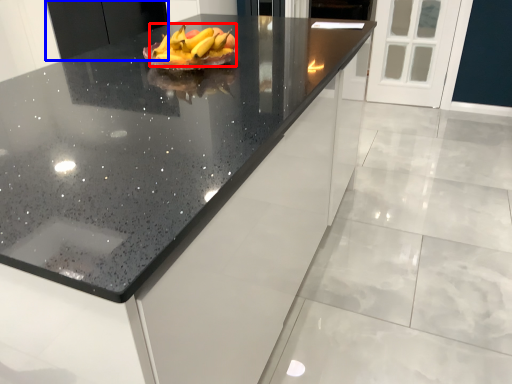
Question: Which of the following is the farthest to the observer, grapefruit (highlighted by a red box) or cabinetry (highlighted by a blue box)?

Choices:
 (A) grapefruit
 (B) cabinetry

Answer: (B)